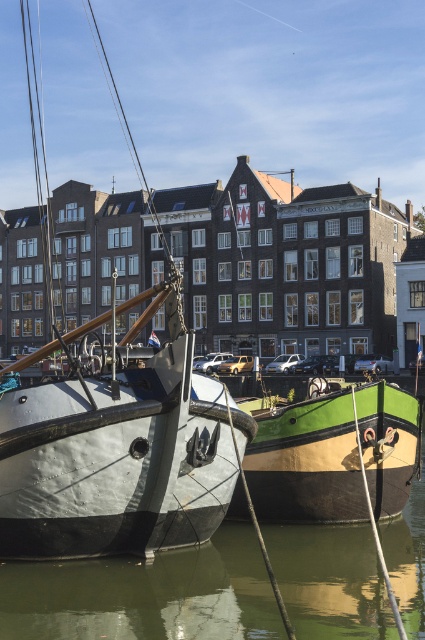
Question: Where is green rubber boat at center located in relation to green matte boat at center in the image?

Choices:
 (A) below
 (B) above

Answer: (A)

Question: Among these points, which one is farthest from the camera?

Choices:
 (A) (221, 387)
 (B) (289, 592)

Answer: (A)

Question: Can you confirm if matte black boat at left is thinner than green rubber boat at center?

Choices:
 (A) no
 (B) yes

Answer: (A)

Question: Among these objects, which one is nearest to the camera?

Choices:
 (A) green rubber boat at center
 (B) matte black boat at left
 (C) green matte boat at center

Answer: (A)

Question: Among these points, which one is nearest to the camera?

Choices:
 (A) coord(277,445)
 (B) coord(167,410)

Answer: (B)

Question: Can you confirm if matte black boat at left is smaller than green rubber boat at center?

Choices:
 (A) yes
 (B) no

Answer: (B)